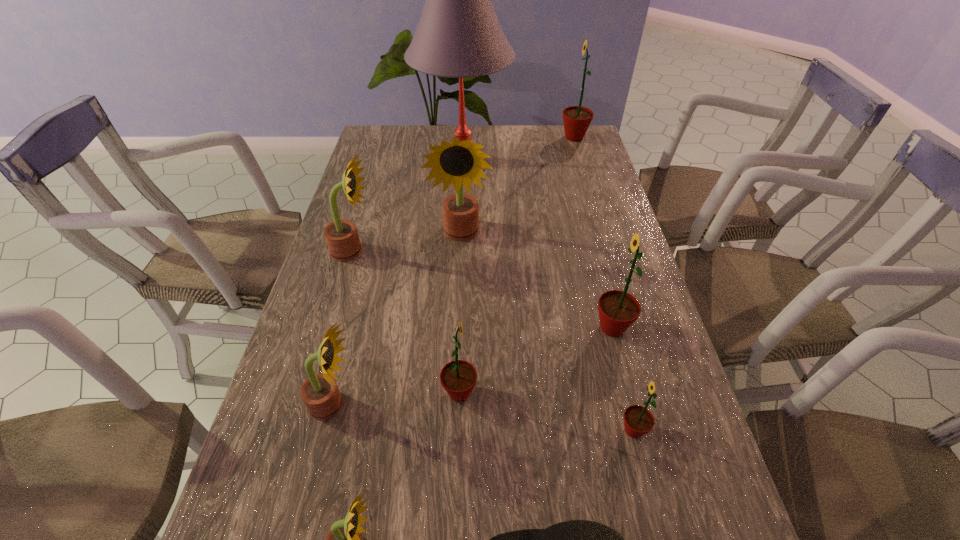
In order to click on the second nearest green sunflower in this screenshot , I will do `click(458, 377)`.

I want to click on the nearest green sunflower, so click(638, 420).

The image size is (960, 540). In order to click on free space located 0.340m on the front-facing side of the tallest object in this screenshot , I will do `click(459, 258)`.

The height and width of the screenshot is (540, 960). In order to click on free location located on the face of the biggest green sunflower in this screenshot , I will do `click(537, 138)`.

I want to click on free space located 0.230m on the face of the biggest green sunflower, so click(500, 138).

The width and height of the screenshot is (960, 540). Identify the location of vacant space located on the face of the biggest green sunflower. (521, 138).

Identify the location of free space located on the face of the rightmost yellow sunflower. (460, 267).

Find the location of a particular element. Image resolution: width=960 pixels, height=540 pixels. vacant space positioned on the face of the second biggest yellow sunflower is located at coordinates (417, 251).

Where is `vacant region located 0.150m on the face of the third nearest green sunflower`? Image resolution: width=960 pixels, height=540 pixels. vacant region located 0.150m on the face of the third nearest green sunflower is located at coordinates (531, 328).

The image size is (960, 540). What are the coordinates of `blank space located on the face of the third nearest green sunflower` in the screenshot? It's located at (535, 328).